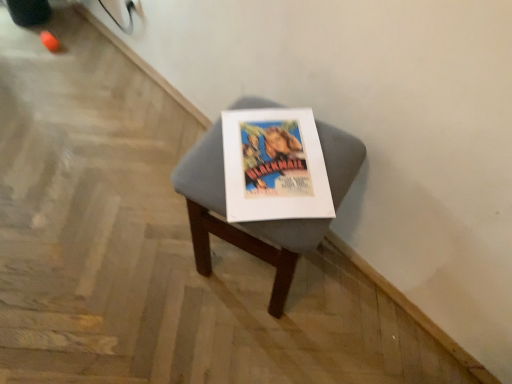
This screenshot has width=512, height=384. What are the coordinates of `free spot below gray fabric stool at center (from a real-world perspective)` in the screenshot? It's located at (246, 271).